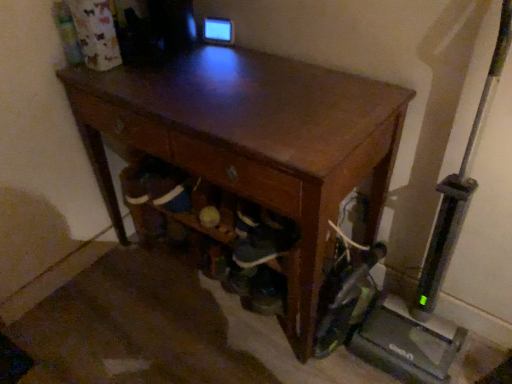
In order to click on shiny brown desk at center in this screenshot , I will do `click(253, 142)`.

From the picture: What is the approximate width of shiny brown desk at center?

49.04 centimeters.

Describe the element at coordinates (253, 142) in the screenshot. I see `shiny brown desk at center` at that location.

This screenshot has height=384, width=512. What do you see at coordinates (238, 174) in the screenshot? I see `wooden drawer at center` at bounding box center [238, 174].

What is the approximate height of wooden drawer at center?

The height of wooden drawer at center is 8.18 inches.

Image resolution: width=512 pixels, height=384 pixels. In order to click on wooden drawer at center in this screenshot , I will do `click(238, 174)`.

Where is `shiny brown desk at center`? The height and width of the screenshot is (384, 512). shiny brown desk at center is located at coordinates (253, 142).

Visually, is wooden drawer at center positioned to the left or to the right of shiny brown desk at center?

Based on their positions, wooden drawer at center is located to the left of shiny brown desk at center.

Is wooden drawer at center positioned before shiny brown desk at center?

That is False.

Is point (258, 196) closer to camera compared to point (233, 187)?

Yes, point (258, 196) is in front of point (233, 187).

From the image's perspective, is wooden drawer at center located above or below shiny brown desk at center?

wooden drawer at center is above shiny brown desk at center.

From a real-world perspective, is wooden drawer at center on shiny brown desk at center?

Yes.

Which of these two, wooden drawer at center or shiny brown desk at center, is wider?

shiny brown desk at center.

Based on the photo, who is taller, wooden drawer at center or shiny brown desk at center?

With more height is shiny brown desk at center.

Based on the photo, between wooden drawer at center and shiny brown desk at center, which one has smaller size?

With smaller size is wooden drawer at center.

Is wooden drawer at center surrounding shiny brown desk at center?

No, wooden drawer at center does not contain shiny brown desk at center.

Is wooden drawer at center beside shiny brown desk at center?

They are not placed beside each other.

Could you tell me if wooden drawer at center is facing shiny brown desk at center?

Yes.

What are the coordinates of `drawer above the shiny brown desk at center (from the image's perspective)` in the screenshot? It's located at (238, 174).

Considering the relative positions of shiny brown desk at center and wooden drawer at center in the image provided, is shiny brown desk at center to the right of wooden drawer at center from the viewer's perspective?

Yes.

Considering the positions of objects shiny brown desk at center and wooden drawer at center in the image provided, who is behind, shiny brown desk at center or wooden drawer at center?

wooden drawer at center is further from the camera.

Does point (282, 318) appear closer or farther from the camera than point (295, 185)?

Point (282, 318) appears to be farther away from the viewer than point (295, 185).

From the image's perspective, is shiny brown desk at center below wooden drawer at center?

Indeed, from the image's perspective, shiny brown desk at center is shown beneath wooden drawer at center.

From the picture: From a real-world perspective, which is physically above, shiny brown desk at center or wooden drawer at center?

wooden drawer at center is physically above.

Is shiny brown desk at center wider or thinner than wooden drawer at center?

shiny brown desk at center is wider than wooden drawer at center.

Considering the relative sizes of shiny brown desk at center and wooden drawer at center in the image provided, is shiny brown desk at center shorter than wooden drawer at center?

In fact, shiny brown desk at center may be taller than wooden drawer at center.

Is shiny brown desk at center bigger or smaller than wooden drawer at center?

In the image, shiny brown desk at center appears to be larger than wooden drawer at center.

Which is correct: shiny brown desk at center is inside wooden drawer at center, or outside of it?

shiny brown desk at center is not enclosed by wooden drawer at center.

Is shiny brown desk at center directly adjacent to wooden drawer at center?

No.

Could you tell me if shiny brown desk at center is turned towards wooden drawer at center?

Yes, shiny brown desk at center is oriented towards wooden drawer at center.

How different are the orientations of shiny brown desk at center and wooden drawer at center in degrees?

The facing directions of shiny brown desk at center and wooden drawer at center are 1.96 degrees apart.

Measure the distance from shiny brown desk at center to wooden drawer at center.

A distance of 7.28 inches exists between shiny brown desk at center and wooden drawer at center.

Identify the location of desk that appears in front of the wooden drawer at center. This screenshot has width=512, height=384. (253, 142).

Where is `desk beneath the wooden drawer at center (from a real-world perspective)`? The height and width of the screenshot is (384, 512). desk beneath the wooden drawer at center (from a real-world perspective) is located at coordinates (253, 142).

The height and width of the screenshot is (384, 512). What are the coordinates of `desk in front of the wooden drawer at center` in the screenshot? It's located at (x=253, y=142).